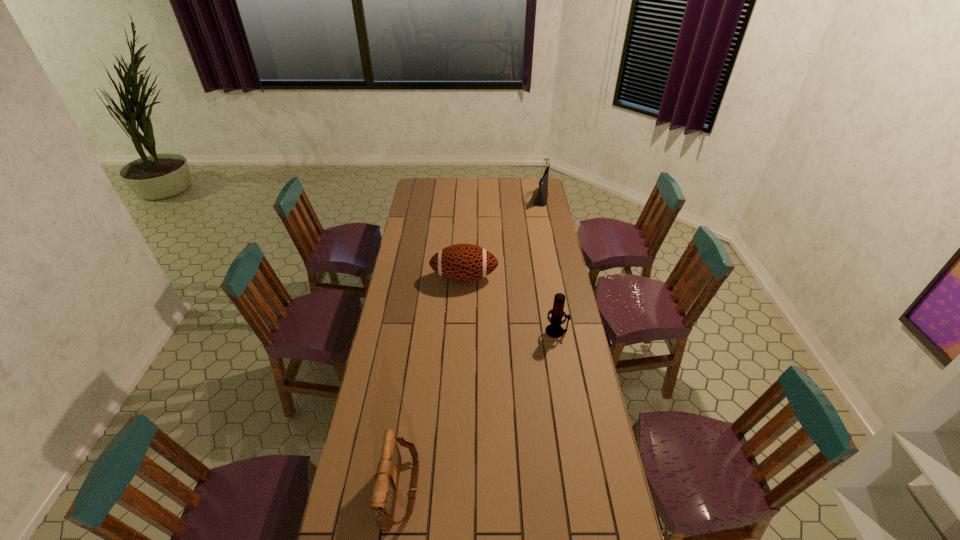
This screenshot has height=540, width=960. I want to click on vacant point that satisfies the following two spatial constraints: 1. on the back side of the football; 2. on the right side of the farthest object, so click(x=468, y=199).

Where is `blank area in the image that satisfies the following two spatial constraints: 1. on the front side of the third farthest object; 2. on the left side of the football`? This screenshot has height=540, width=960. blank area in the image that satisfies the following two spatial constraints: 1. on the front side of the third farthest object; 2. on the left side of the football is located at coordinates (462, 331).